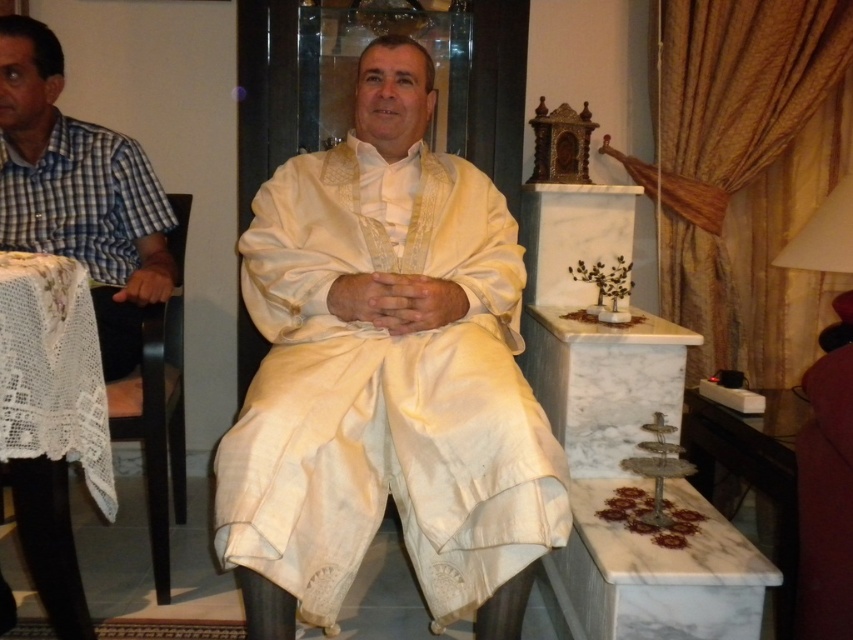
Question: Does white silk robe at center appear on the left side of black wood chair at left?

Choices:
 (A) no
 (B) yes

Answer: (A)

Question: Is white silk robe at center below black wood chair at left?

Choices:
 (A) yes
 (B) no

Answer: (B)

Question: Is white silk robe at center thinner than black wood chair at left?

Choices:
 (A) no
 (B) yes

Answer: (A)

Question: Among these points, which one is nearest to the camera?

Choices:
 (A) (0, 323)
 (B) (277, 520)
 (C) (178, 378)

Answer: (A)

Question: Which of these objects is positioned closest to the crocheted lace tablecloth at left?

Choices:
 (A) black wood chair at left
 (B) white silk robe at center

Answer: (A)

Question: Among these objects, which one is farthest from the camera?

Choices:
 (A) crocheted lace tablecloth at left
 (B) black wood chair at left

Answer: (B)